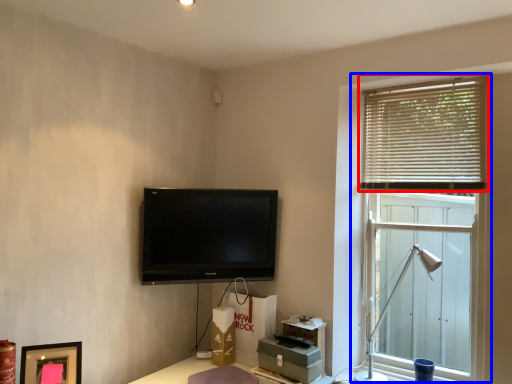
Question: Which object is further to the camera taking this photo, window blind (highlighted by a red box) or window (highlighted by a blue box)?

Choices:
 (A) window blind
 (B) window

Answer: (A)